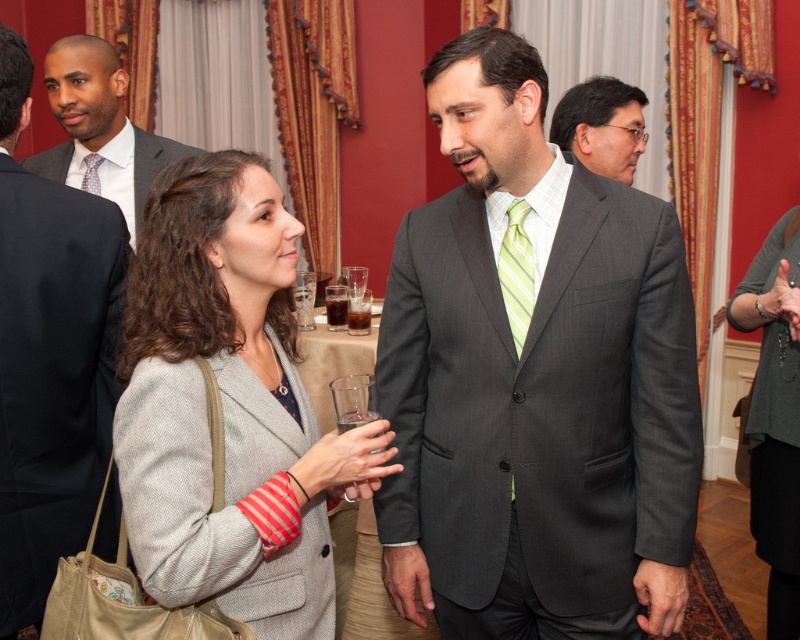
Question: Does gray herringbone blazer at center appear under matte black suit at upper left?

Choices:
 (A) no
 (B) yes

Answer: (B)

Question: Is gray herringbone blazer at center further to camera compared to matte gray suit at upper right?

Choices:
 (A) yes
 (B) no

Answer: (B)

Question: Which of the following is the farthest from the observer?

Choices:
 (A) matte black suit at left
 (B) matte gray suit at upper right
 (C) light blue striped tie at center

Answer: (C)

Question: Which of the following is the farthest from the observer?

Choices:
 (A) (98, 157)
 (B) (130, 152)
 (C) (502, 240)

Answer: (B)

Question: Which object is closer to the camera taking this photo?

Choices:
 (A) light blue striped tie at center
 (B) translucent glass at center
 (C) clear glass at center

Answer: (A)

Question: Does clear glass at center appear under light blue striped tie at center?

Choices:
 (A) no
 (B) yes

Answer: (B)